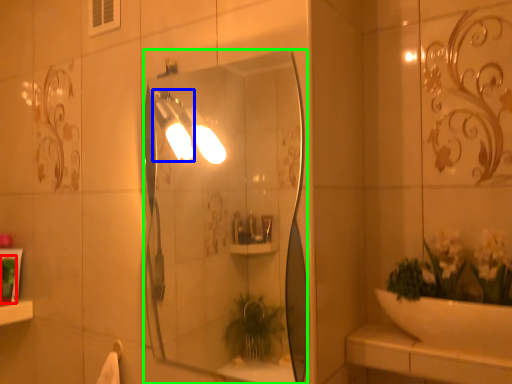
Question: Estimate the real-world distances between objects in this image. Which object is closer to toiletry (highlighted by a red box), light fixture (highlighted by a blue box) or mirror (highlighted by a green box)?

Choices:
 (A) light fixture
 (B) mirror

Answer: (A)